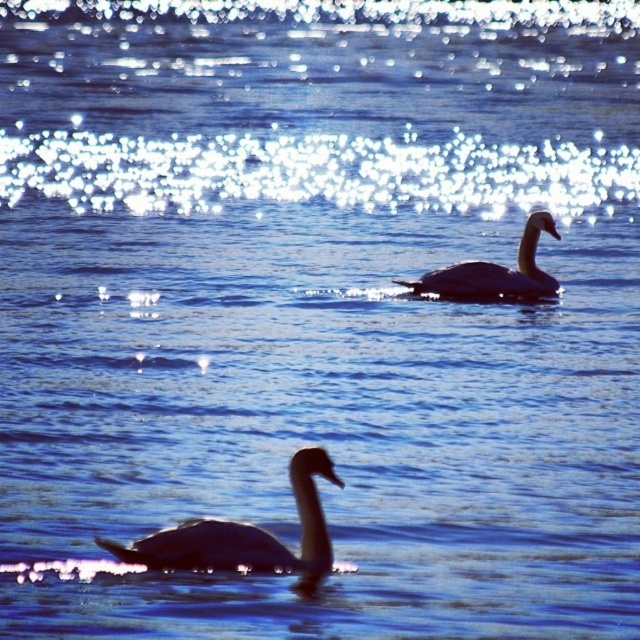
Question: Is silvery glossy swan at lower left below gray matte swan at upper right?

Choices:
 (A) yes
 (B) no

Answer: (A)

Question: Is silvery glossy swan at lower left further to camera compared to gray matte swan at upper right?

Choices:
 (A) yes
 (B) no

Answer: (B)

Question: Which of the following is the farthest from the observer?

Choices:
 (A) silvery glossy swan at lower left
 (B) gray matte swan at upper right

Answer: (B)

Question: Is silvery glossy swan at lower left wider than gray matte swan at upper right?

Choices:
 (A) yes
 (B) no

Answer: (B)